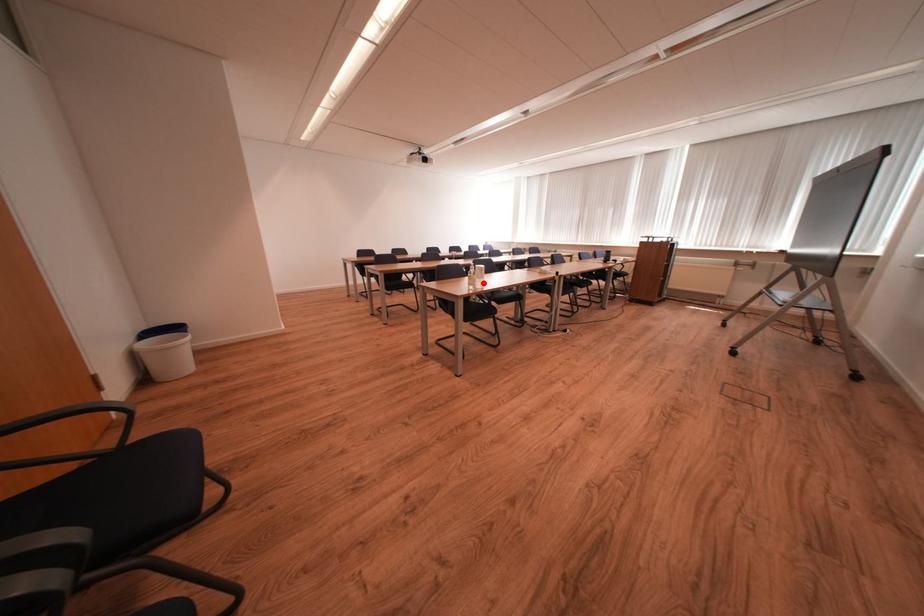
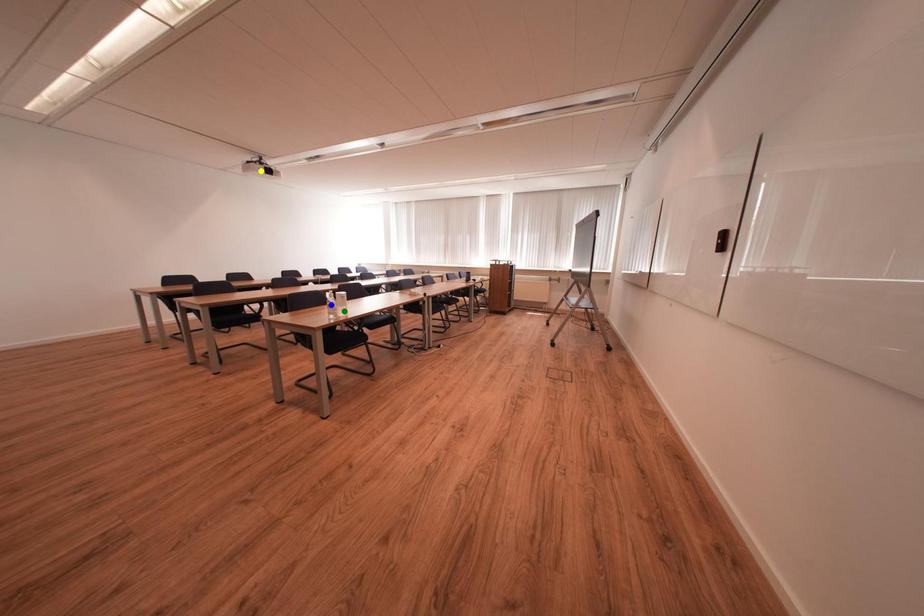
Question: I am providing you with two images of the same scene from different viewpoints. A red point is marked on the first image. You are given multiple points on the second image. Which spot in image 2 lines up with the point in image 1?

Choices:
 (A) yellow point
 (B) green point
 (C) blue point

Answer: (B)